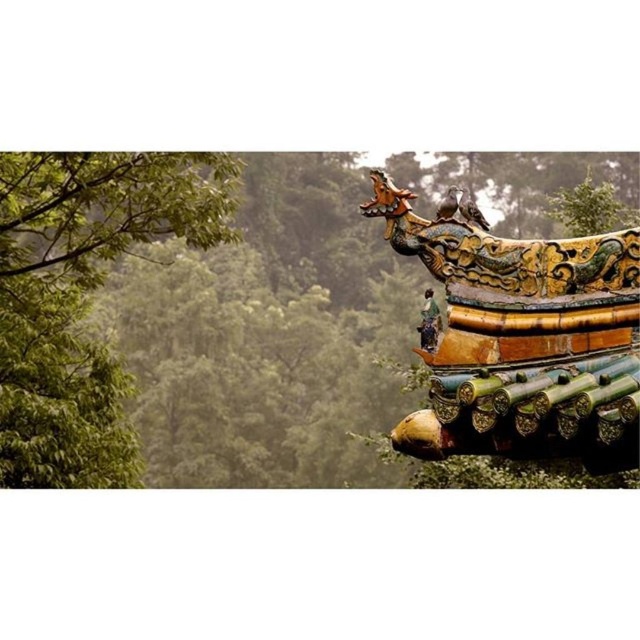
Question: Can you confirm if gold/gilded wood dragon at upper right is bigger than green leafy tree at left?

Choices:
 (A) no
 (B) yes

Answer: (A)

Question: Among these points, which one is nearest to the camera?

Choices:
 (A) (483, 372)
 (B) (602, 364)
 (C) (116, 177)

Answer: (B)

Question: Is green leafy tree at upper left to the left of green leafy tree at left from the viewer's perspective?

Choices:
 (A) yes
 (B) no

Answer: (B)

Question: Which object appears farthest from the camera in this image?

Choices:
 (A) green leafy tree at left
 (B) gold/gilded wood dragon at upper right

Answer: (A)

Question: Which of the following is the farthest from the observer?

Choices:
 (A) (134, 465)
 (B) (637, 292)
 (C) (568, 403)

Answer: (A)

Question: Does gold/gilded wood dragon at upper right come behind green leafy tree at left?

Choices:
 (A) yes
 (B) no

Answer: (B)